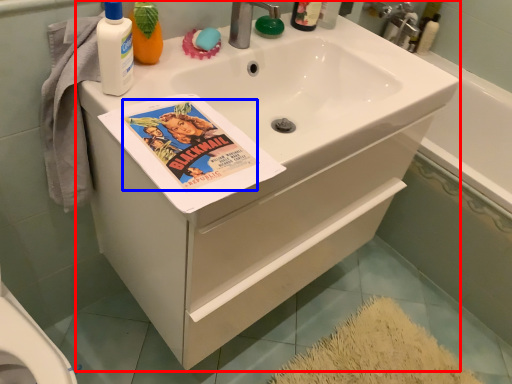
Question: Among these objects, which one is nearest to the camera, bathroom cabinet (highlighted by a red box) or comic book character (highlighted by a blue box)?

Choices:
 (A) bathroom cabinet
 (B) comic book character

Answer: (B)